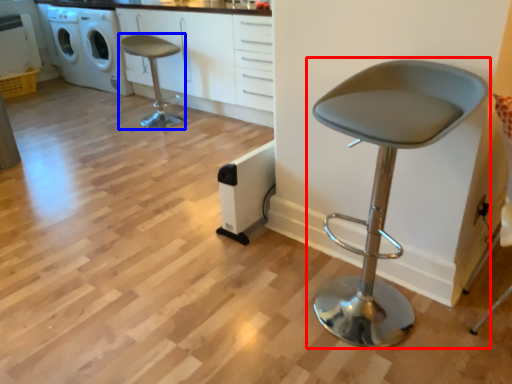
Question: Among these objects, which one is farthest to the camera, chair (highlighted by a red box) or chair (highlighted by a blue box)?

Choices:
 (A) chair
 (B) chair

Answer: (B)